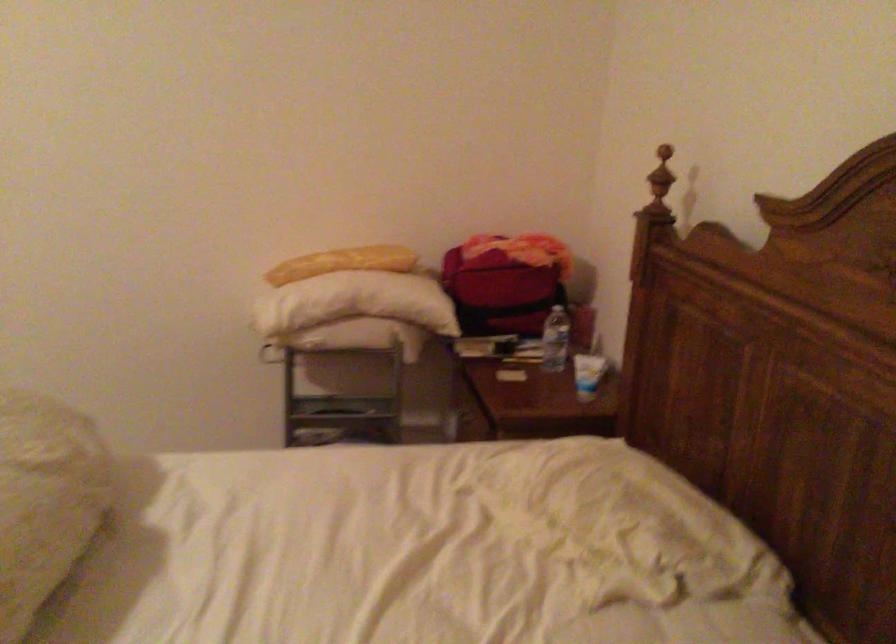
This screenshot has width=896, height=644. What do you see at coordinates (556, 339) in the screenshot?
I see `a plastic water bottle` at bounding box center [556, 339].